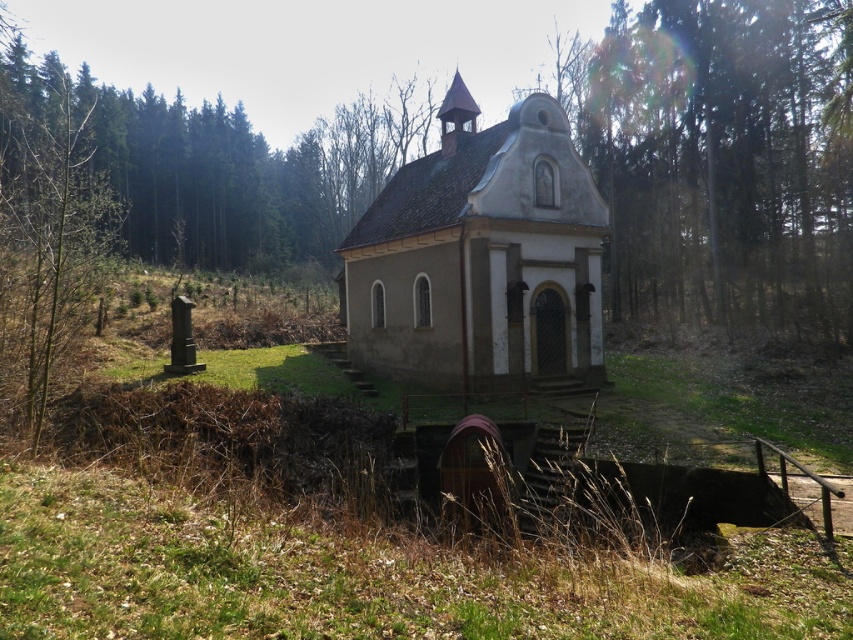
Question: Among these points, which one is nearest to the camera?

Choices:
 (A) (38, 403)
 (B) (547, 304)

Answer: (A)

Question: Is beige stone church at center further to camera compared to brown wood tree at left?

Choices:
 (A) no
 (B) yes

Answer: (B)

Question: Is beige stone church at center below brown wood tree at left?

Choices:
 (A) no
 (B) yes

Answer: (B)

Question: Does beige stone church at center appear on the left side of brown wood tree at left?

Choices:
 (A) yes
 (B) no

Answer: (B)